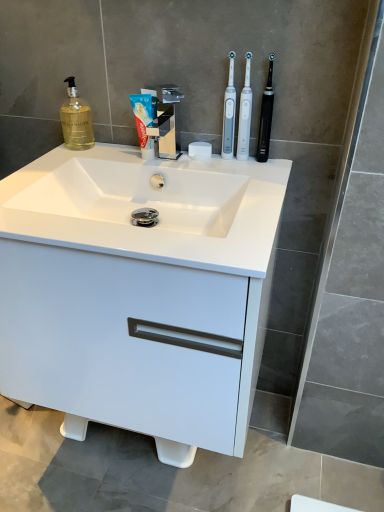
Find the location of a particular element. This screenshot has width=384, height=512. vacant space that's between translucent glass soap dispenser at upper left and polished chrome faucet at center is located at coordinates (116, 156).